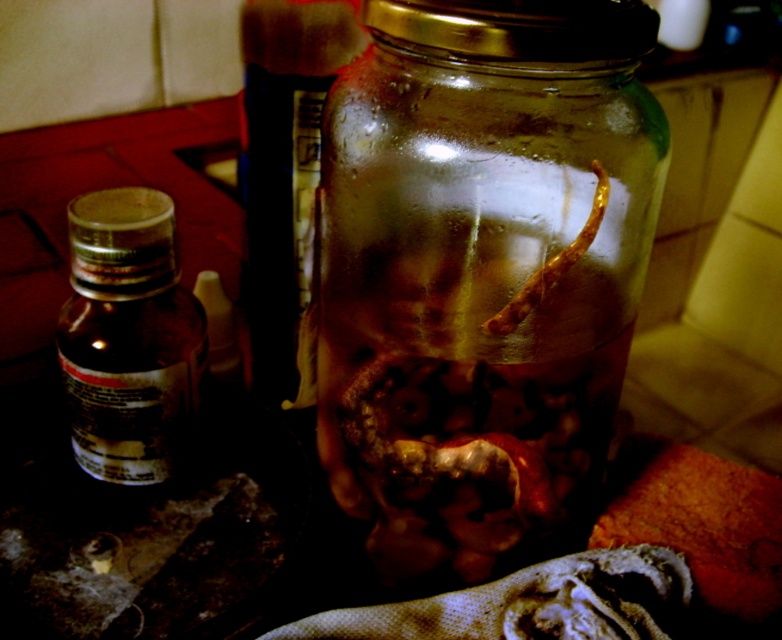
Does transparent glass jar at center have a lesser height compared to brown matte bottle at left?

In fact, transparent glass jar at center may be taller than brown matte bottle at left.

The height and width of the screenshot is (640, 782). Find the location of `transparent glass jar at center`. transparent glass jar at center is located at coordinates (479, 269).

What are the coordinates of `transparent glass jar at center` in the screenshot? It's located at (479, 269).